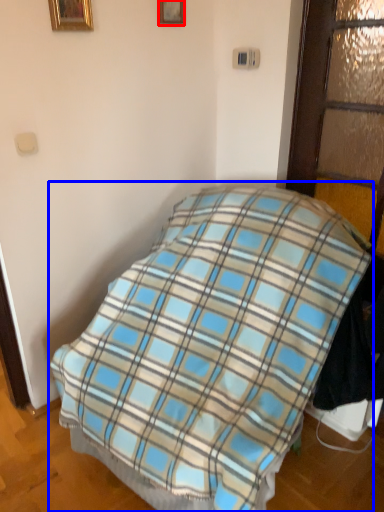
Question: Which of the following is the closest to the observer, picture frame (highlighted by a red box) or bed (highlighted by a blue box)?

Choices:
 (A) picture frame
 (B) bed

Answer: (B)